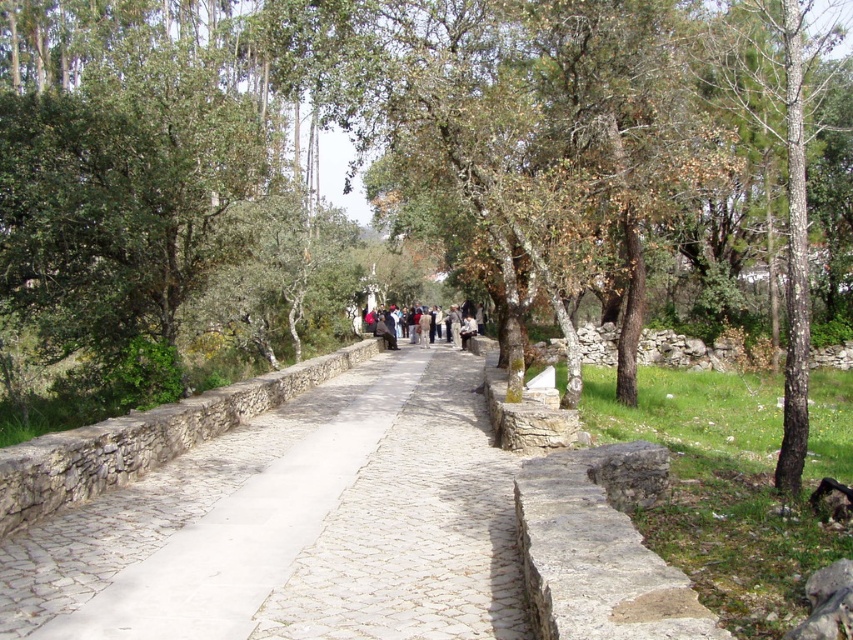
You are standing at the starting point of the cobblestone pathway. Looking ahead, you see a point marked at coordinates (x=296, y=525). What does this point indicate?

The point at coordinates (x=296, y=525) marks the location of the white stone path at center.

From the picture: You are a gardener who needs to walk along the white stone path at center while carrying the dark gray fabric jacket at center. Can you walk comfortably without the jacket spilling over the path?

The white stone path at center occupies less space than the dark gray fabric jacket at center, so the jacket may spill over the path when carried, making it difficult to walk comfortably.